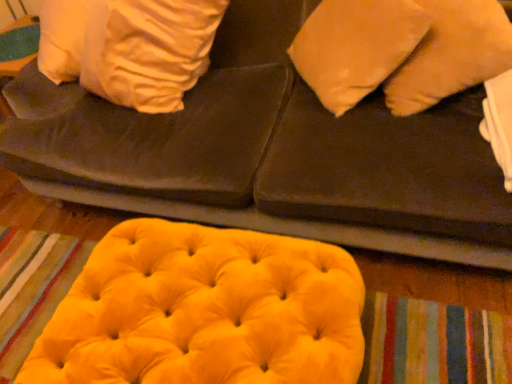
Question: Could you tell me if matte orange pillow at upper right is turned towards velvet yellow ottoman at lower center?

Choices:
 (A) yes
 (B) no

Answer: (A)

Question: From the image's perspective, is matte orange pillow at upper right located beneath velvet yellow ottoman at lower center?

Choices:
 (A) yes
 (B) no

Answer: (B)

Question: Is matte orange pillow at upper right not within velvet yellow ottoman at lower center?

Choices:
 (A) no
 (B) yes

Answer: (A)

Question: Is matte orange pillow at upper right surrounding velvet yellow ottoman at lower center?

Choices:
 (A) no
 (B) yes

Answer: (A)

Question: Is matte orange pillow at upper right touching velvet yellow ottoman at lower center?

Choices:
 (A) yes
 (B) no

Answer: (B)

Question: From the image's perspective, relative to matte orange pillow at upper right, is velvet yellow bean bag at lower center above or below?

Choices:
 (A) below
 (B) above

Answer: (A)

Question: From a real-world perspective, relative to matte orange pillow at upper right, is velvet yellow bean bag at lower center vertically above or below?

Choices:
 (A) above
 (B) below

Answer: (B)

Question: Visually, is velvet yellow bean bag at lower center positioned to the left or to the right of matte orange pillow at upper right?

Choices:
 (A) right
 (B) left

Answer: (B)

Question: Is velvet yellow bean bag at lower center taller or shorter than matte orange pillow at upper right?

Choices:
 (A) short
 (B) tall

Answer: (A)

Question: In terms of size, does matte orange pillow at upper right appear bigger or smaller than velvet yellow bean bag at lower center?

Choices:
 (A) small
 (B) big

Answer: (A)

Question: Is matte orange pillow at upper right in front of or behind velvet yellow bean bag at lower center in the image?

Choices:
 (A) front
 (B) behind

Answer: (B)

Question: Considering the positions of matte orange pillow at upper right and velvet yellow bean bag at lower center in the image, is matte orange pillow at upper right wider or thinner than velvet yellow bean bag at lower center?

Choices:
 (A) wide
 (B) thin

Answer: (B)

Question: In the image, is matte orange pillow at upper right on the left side or the right side of velvet yellow bean bag at lower center?

Choices:
 (A) left
 (B) right

Answer: (B)

Question: From a real-world perspective, is velvet yellow ottoman at lower center above or below matte orange pillow at upper right?

Choices:
 (A) above
 (B) below

Answer: (B)

Question: Does point (64, 188) appear closer or farther from the camera than point (310, 34)?

Choices:
 (A) closer
 (B) farther

Answer: (B)